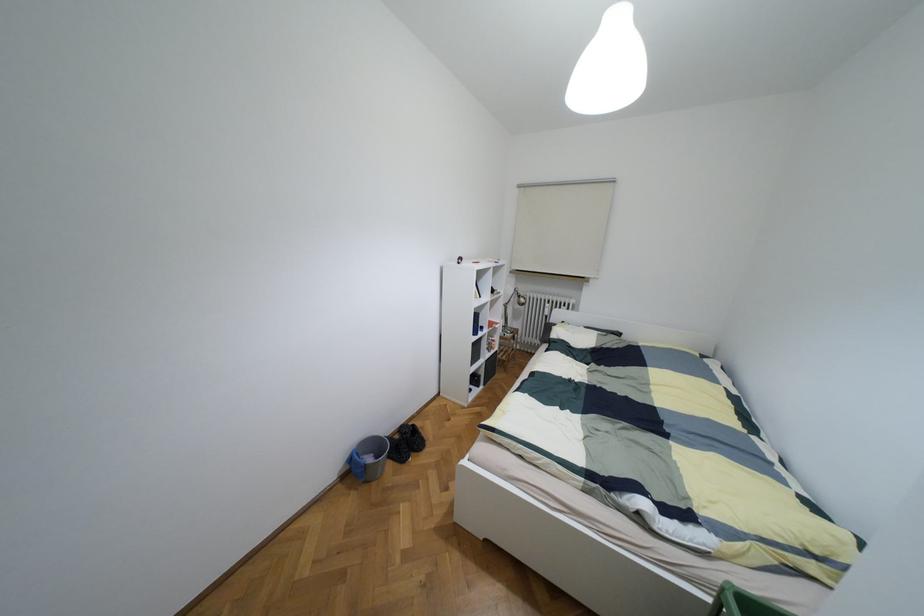
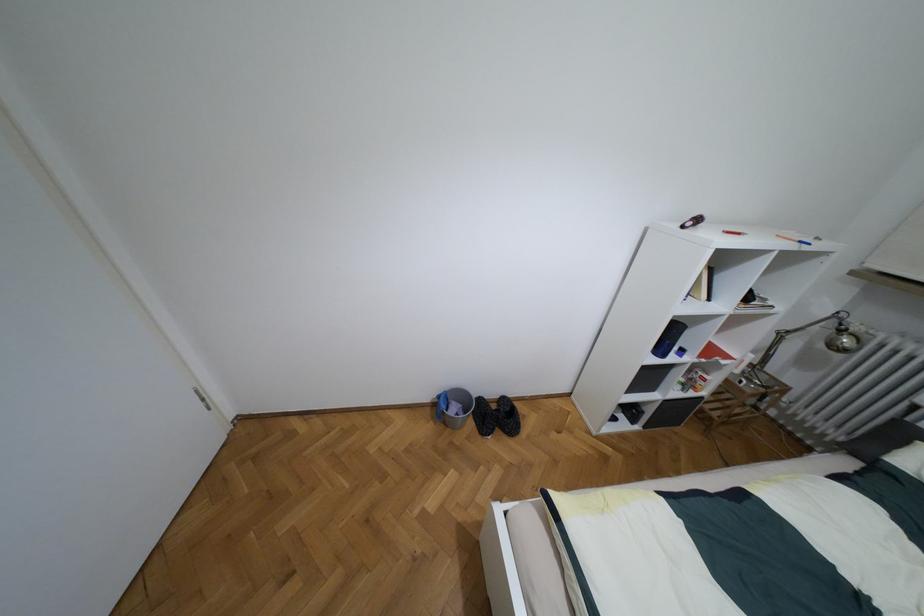
In the second image, find the point that corresponds to pixel 517 296 in the first image.

(840, 330)